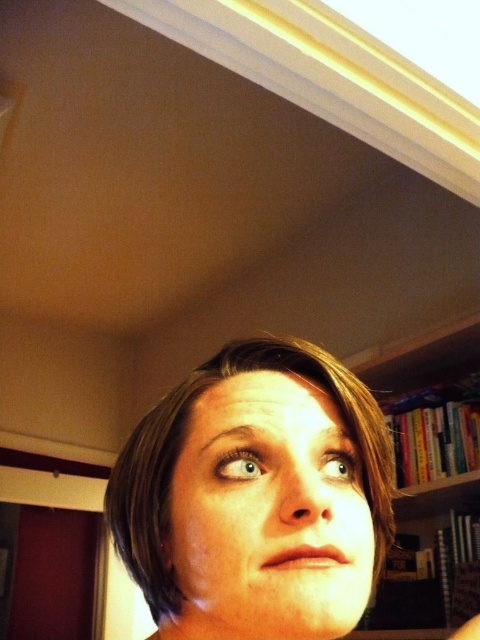
Is smooth skin face at center bigger than hardcover books at right?

No.

The image size is (480, 640). What are the coordinates of `smooth skin face at center` in the screenshot? It's located at (267, 515).